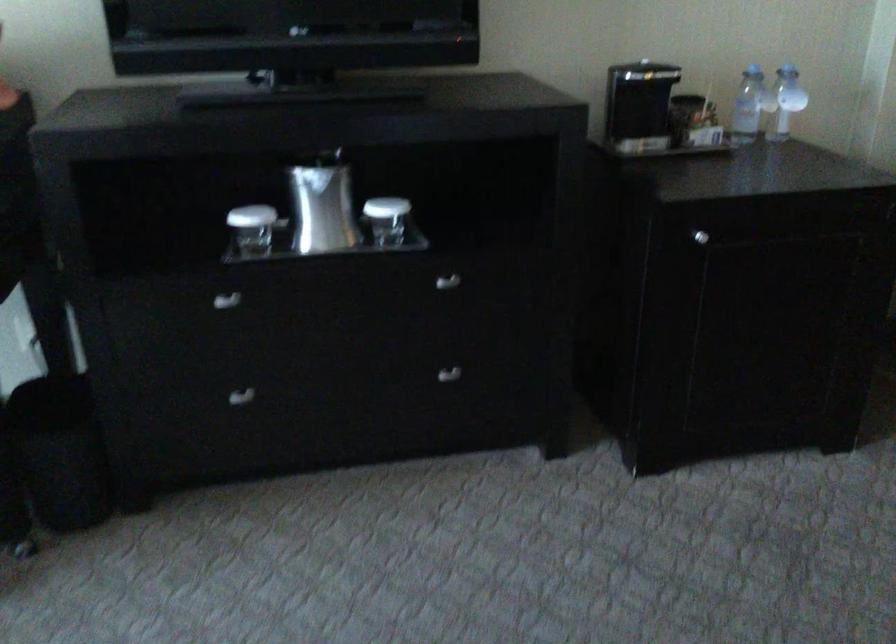
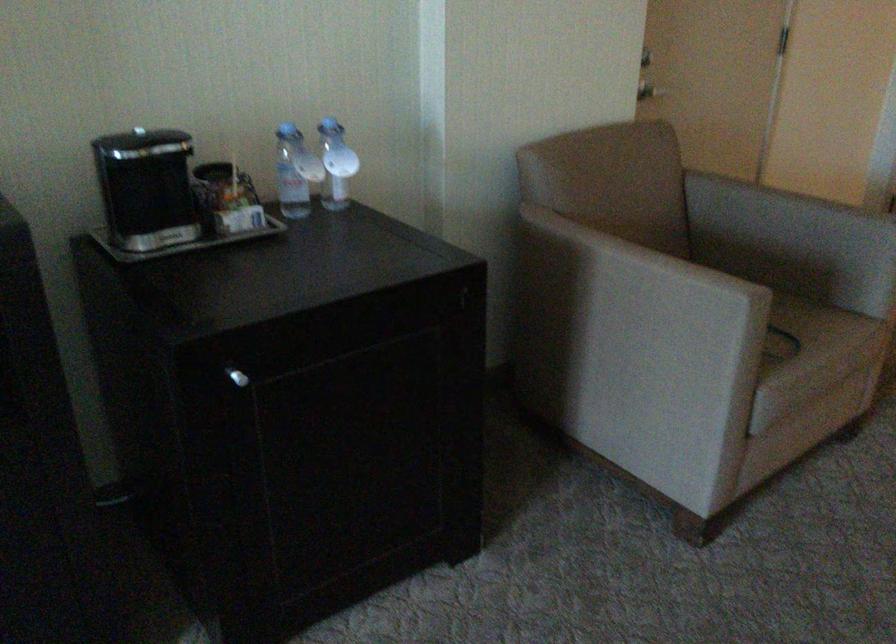
In the second image, find the point that corresponds to [756,93] in the first image.

(295, 172)